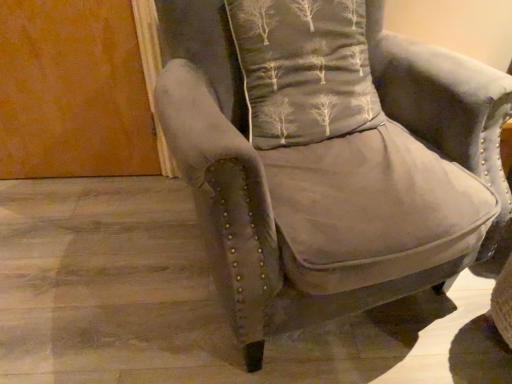
Image resolution: width=512 pixels, height=384 pixels. What do you see at coordinates (305, 69) in the screenshot? I see `dark gray fabric pillow with tree pattern at upper center` at bounding box center [305, 69].

The image size is (512, 384). Identify the location of dark gray fabric pillow with tree pattern at upper center. (305, 69).

The width and height of the screenshot is (512, 384). Identify the location of suede-like gray armchair at center. (328, 156).

This screenshot has width=512, height=384. What do you see at coordinates (328, 156) in the screenshot? I see `suede-like gray armchair at center` at bounding box center [328, 156].

Find the location of a particular element. The width and height of the screenshot is (512, 384). dark gray fabric pillow with tree pattern at upper center is located at coordinates (305, 69).

Would you say dark gray fabric pillow with tree pattern at upper center is to the left or to the right of suede-like gray armchair at center in the picture?

From the image, it's evident that dark gray fabric pillow with tree pattern at upper center is to the left of suede-like gray armchair at center.

Considering their positions, is dark gray fabric pillow with tree pattern at upper center located in front of or behind suede-like gray armchair at center?

Visually, dark gray fabric pillow with tree pattern at upper center is located behind suede-like gray armchair at center.

Between point (342, 14) and point (305, 301), which one is positioned behind?

Positioned behind is point (342, 14).

From the image's perspective, does dark gray fabric pillow with tree pattern at upper center appear lower than suede-like gray armchair at center?

No, from the image's perspective, dark gray fabric pillow with tree pattern at upper center is not beneath suede-like gray armchair at center.

From a real-world perspective, is dark gray fabric pillow with tree pattern at upper center above or below suede-like gray armchair at center?

Clearly, from a real-world perspective, dark gray fabric pillow with tree pattern at upper center is above suede-like gray armchair at center.

In terms of width, does dark gray fabric pillow with tree pattern at upper center look wider or thinner when compared to suede-like gray armchair at center?

dark gray fabric pillow with tree pattern at upper center is thinner than suede-like gray armchair at center.

Can you confirm if dark gray fabric pillow with tree pattern at upper center is shorter than suede-like gray armchair at center?

Yes.

Considering the relative sizes of dark gray fabric pillow with tree pattern at upper center and suede-like gray armchair at center in the image provided, is dark gray fabric pillow with tree pattern at upper center bigger than suede-like gray armchair at center?

No.

Would you say dark gray fabric pillow with tree pattern at upper center is inside or outside suede-like gray armchair at center?

The correct answer is: inside.

Is dark gray fabric pillow with tree pattern at upper center positioned far away from suede-like gray armchair at center?

That's not correct — dark gray fabric pillow with tree pattern at upper center is a little close to suede-like gray armchair at center.

Is dark gray fabric pillow with tree pattern at upper center facing away from suede-like gray armchair at center?

Yes, dark gray fabric pillow with tree pattern at upper center is facing away from suede-like gray armchair at center.

Could you measure the distance between dark gray fabric pillow with tree pattern at upper center and suede-like gray armchair at center?

dark gray fabric pillow with tree pattern at upper center and suede-like gray armchair at center are 4.76 inches apart.

You are a GUI agent. You are given a task and a screenshot of the screen. Output one action in this format:
    pyautogui.click(x=<x>, y=<y>)
    Task: Click on the chair that appears on the right of dark gray fabric pillow with tree pattern at upper center
    The width and height of the screenshot is (512, 384).
    Given the screenshot: What is the action you would take?
    pyautogui.click(x=328, y=156)

Looking at this image, does suede-like gray armchair at center appear on the right side of dark gray fabric pillow with tree pattern at upper center?

Yes, suede-like gray armchair at center is to the right of dark gray fabric pillow with tree pattern at upper center.

In the image, is suede-like gray armchair at center positioned in front of or behind dark gray fabric pillow with tree pattern at upper center?

suede-like gray armchair at center is positioned closer to the viewer than dark gray fabric pillow with tree pattern at upper center.

Is point (389, 111) closer or farther from the camera than point (250, 125)?

Point (389, 111) is positioned farther from the camera compared to point (250, 125).

From the image's perspective, does suede-like gray armchair at center appear lower than dark gray fabric pillow with tree pattern at upper center?

Yes, from the image's perspective, suede-like gray armchair at center is beneath dark gray fabric pillow with tree pattern at upper center.

From a real-world perspective, who is located higher, suede-like gray armchair at center or dark gray fabric pillow with tree pattern at upper center?

dark gray fabric pillow with tree pattern at upper center.

Consider the image. Does suede-like gray armchair at center have a lesser width compared to dark gray fabric pillow with tree pattern at upper center?

No, suede-like gray armchair at center is not thinner than dark gray fabric pillow with tree pattern at upper center.

Is suede-like gray armchair at center shorter than dark gray fabric pillow with tree pattern at upper center?

In fact, suede-like gray armchair at center may be taller than dark gray fabric pillow with tree pattern at upper center.

Can you confirm if suede-like gray armchair at center is bigger than dark gray fabric pillow with tree pattern at upper center?

Yes.

Is suede-like gray armchair at center inside the boundaries of dark gray fabric pillow with tree pattern at upper center, or outside?

The correct answer is: outside.

Is suede-like gray armchair at center far from dark gray fabric pillow with tree pattern at upper center?

That's not correct — suede-like gray armchair at center is a little close to dark gray fabric pillow with tree pattern at upper center.

Could you tell me if suede-like gray armchair at center is facing dark gray fabric pillow with tree pattern at upper center?

Yes, suede-like gray armchair at center is facing dark gray fabric pillow with tree pattern at upper center.

How different are the orientations of suede-like gray armchair at center and dark gray fabric pillow with tree pattern at upper center in degrees?

suede-like gray armchair at center and dark gray fabric pillow with tree pattern at upper center are facing 1.63 degrees away from each other.

At what (x,y) coordinates should I click in order to perform the action: click on pillow behind the suede-like gray armchair at center. Please return your answer as a coordinate pair (x, y). Looking at the image, I should click on pos(305,69).

The height and width of the screenshot is (384, 512). I want to click on chair in front of the dark gray fabric pillow with tree pattern at upper center, so pyautogui.click(x=328, y=156).

Find the location of `pillow behind the suede-like gray armchair at center`. pillow behind the suede-like gray armchair at center is located at coordinates (305, 69).